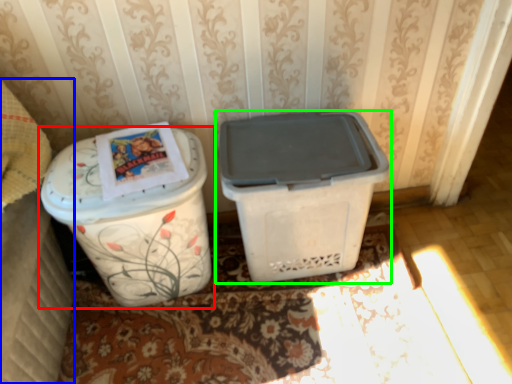
Question: Based on their relative distances, which object is nearer to waste container (highlighted by a red box)? Choose from leftover (highlighted by a blue box) and waste container (highlighted by a green box).

Choices:
 (A) leftover
 (B) waste container

Answer: (A)